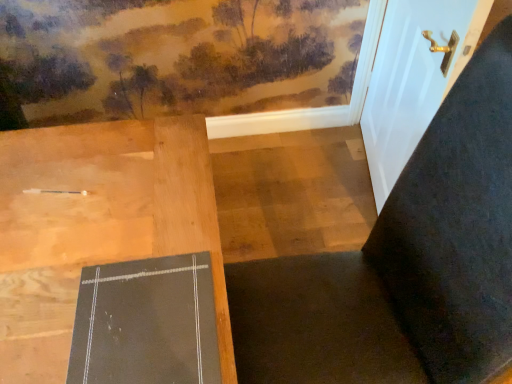
Where is `free space above matte black bulletin board at center (from a real-world perspective)`? free space above matte black bulletin board at center (from a real-world perspective) is located at coordinates (131, 312).